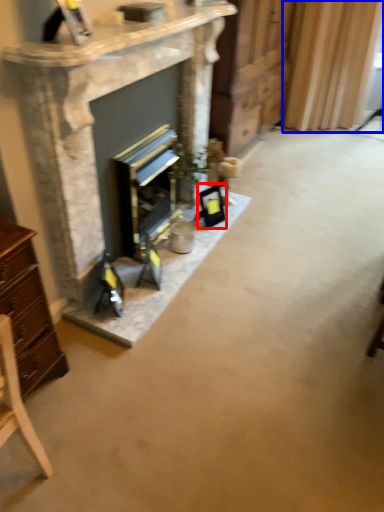
Question: Which of the following is the closest to the observer, picture frame (highlighted by a red box) or curtain (highlighted by a blue box)?

Choices:
 (A) picture frame
 (B) curtain

Answer: (A)